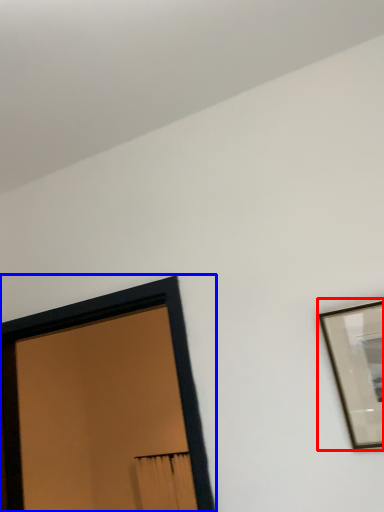
Question: Among these objects, which one is farthest to the camera, picture frame (highlighted by a red box) or picture frame (highlighted by a blue box)?

Choices:
 (A) picture frame
 (B) picture frame

Answer: (B)